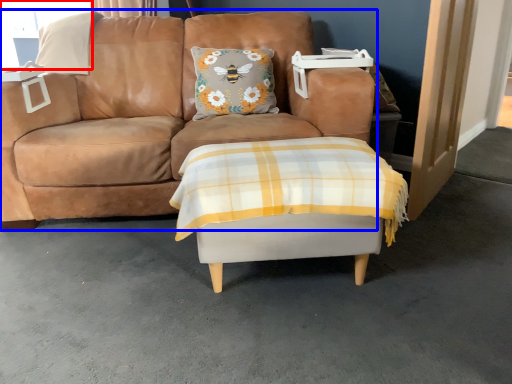
Question: Which object appears farthest to the camera in this image, window screen (highlighted by a red box) or studio couch (highlighted by a blue box)?

Choices:
 (A) window screen
 (B) studio couch

Answer: (A)